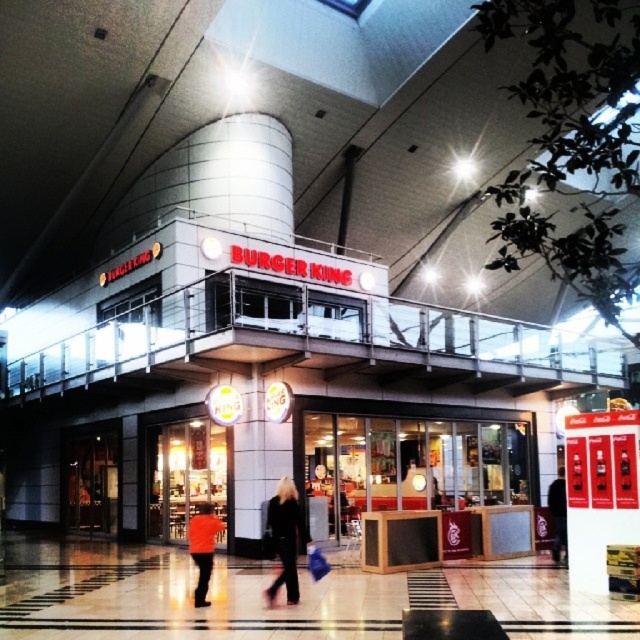
You are trying to decide which jacket to take with you. Both the black leather jacket at center and the black fabric jacket at center are on display. Which one has a larger size?

The black leather jacket at center is bigger than the black fabric jacket at center, so it has a larger size.

In the scene shown: You are standing in front of the Burger King restaurant entrance. You see a black leather jacket at center and an orange fabric jacket at lower center. Which jacket is nearer to you?

The black leather jacket at center is closer to the viewer than the orange fabric jacket at lower center, so the black leather jacket at center is nearer to you.

You are trying to decide which jacket to take with you. Both the black leather jacket at center and the black fabric jacket at center are on a rack. If you have a bag that can only fit one of them, which jacket should you choose based on their size?

The black leather jacket at center is wider than the black fabric jacket at center, so you should choose the black fabric jacket at center to ensure it fits in your bag.